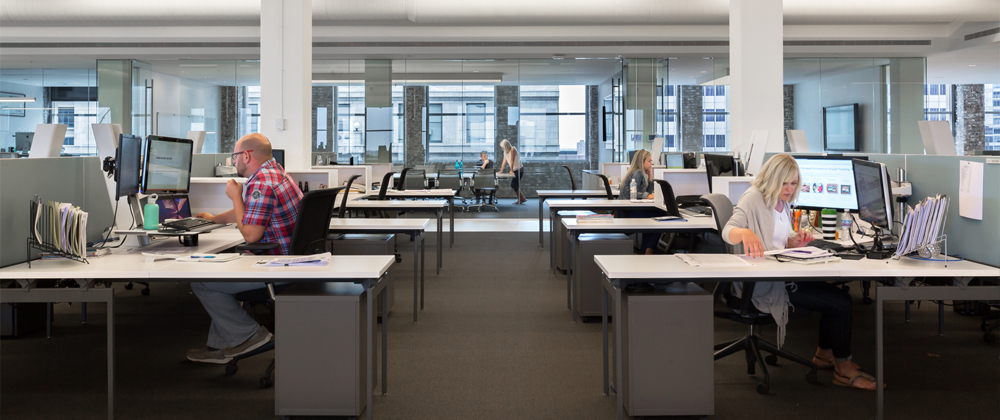
Where is `desks`? This screenshot has height=420, width=1000. desks is located at coordinates (660, 266), (638, 222), (602, 203), (566, 192), (448, 195), (423, 208), (398, 228), (347, 270), (509, 181).